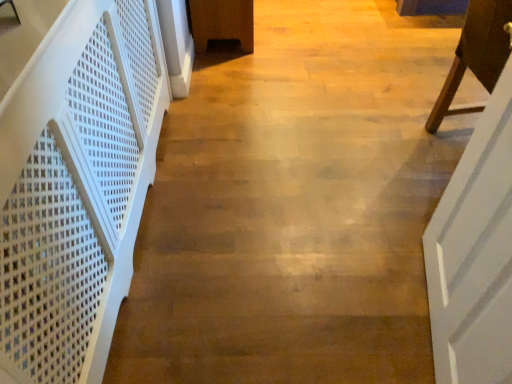
Locate an element on the screen. This screenshot has height=384, width=512. free space to the left of brown wooden chair at right is located at coordinates (367, 148).